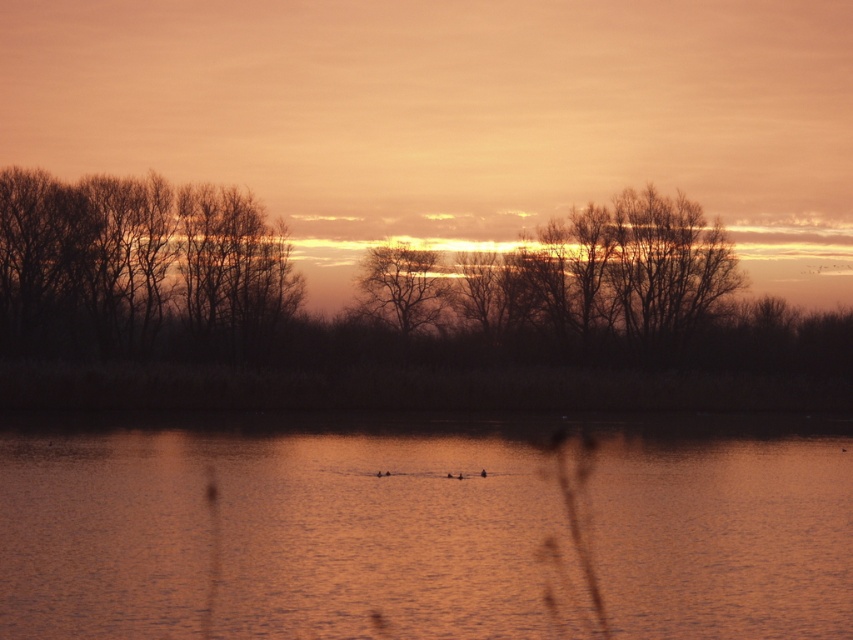
Can you confirm if orange reflective water at center is smaller than bare branches at left?

No.

Where is `orange reflective water at center`? orange reflective water at center is located at coordinates (277, 529).

Where is `orange reflective water at center`? The width and height of the screenshot is (853, 640). orange reflective water at center is located at coordinates (277, 529).

At what (x,y) coordinates should I click in order to perform the action: click on orange reflective water at center. Please return your answer as a coordinate pair (x, y). Looking at the image, I should click on (x=277, y=529).

Is point (360, 584) more distant than point (416, 316)?

No, (360, 584) is in front of (416, 316).

Is orange reflective water at center taller than silhouette bare tree at center?

No.

Who is more forward, [622,499] or [408,321]?

Point [622,499]

Identify the location of orange reflective water at center. The width and height of the screenshot is (853, 640). (277, 529).

The height and width of the screenshot is (640, 853). What do you see at coordinates (136, 266) in the screenshot?
I see `bare branches at left` at bounding box center [136, 266].

Does bare branches at left have a greater width compared to silhouette bare tree at center?

Yes, bare branches at left is wider than silhouette bare tree at center.

Who is more forward, (172, 252) or (432, 289)?

Positioned in front is point (172, 252).

Find the location of a particular element. bare branches at left is located at coordinates (136, 266).